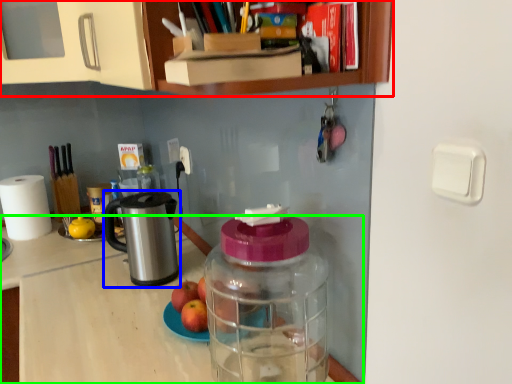
Question: Estimate the real-world distances between objects in this image. Which object is farther from cabinetry (highlighted by a red box), appliance (highlighted by a blue box) or desk (highlighted by a green box)?

Choices:
 (A) appliance
 (B) desk

Answer: (B)